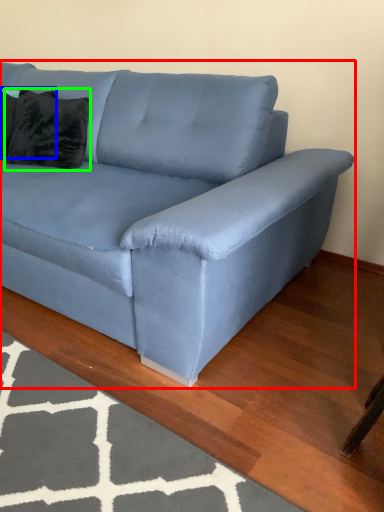
Question: Which is nearer to the studio couch (highlighted by a red box)? pillow (highlighted by a blue box) or pillow (highlighted by a green box).

Choices:
 (A) pillow
 (B) pillow

Answer: (B)